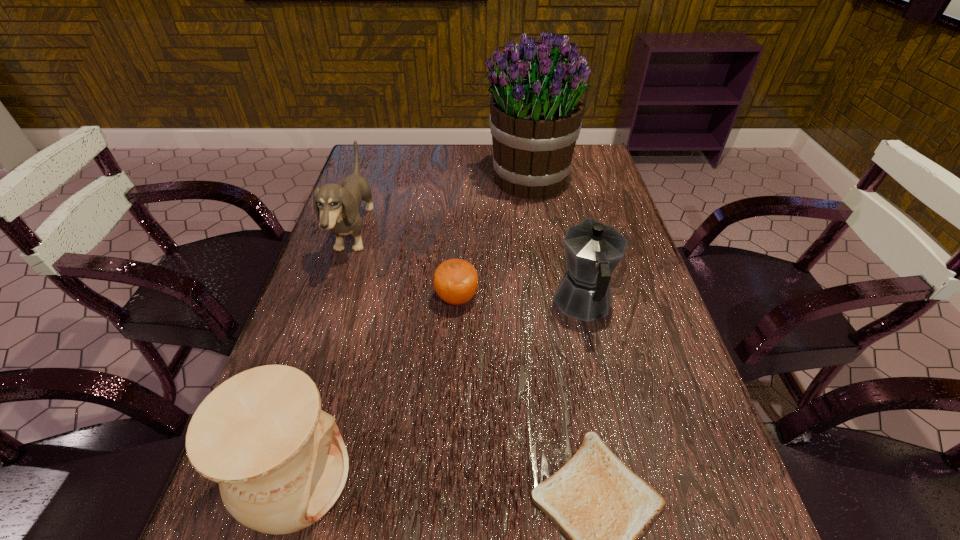
Locate an element on the screen. the tallest object is located at coordinates (536, 109).

Locate an element on the screen. The height and width of the screenshot is (540, 960). coffeepot is located at coordinates (593, 250).

The width and height of the screenshot is (960, 540). Identify the location of puppy. click(337, 207).

Where is `the third object from left to right`? This screenshot has width=960, height=540. the third object from left to right is located at coordinates (455, 281).

Image resolution: width=960 pixels, height=540 pixels. What are the coordinates of `orange` in the screenshot? It's located at (455, 281).

Image resolution: width=960 pixels, height=540 pixels. I want to click on vacant space located on the front of the bouquet, so click(540, 258).

The image size is (960, 540). I want to click on vacant space located 0.270m at the spout of the coffeepot, so click(562, 207).

Where is `free location located 0.340m at the spout of the coffeepot`? This screenshot has width=960, height=540. free location located 0.340m at the spout of the coffeepot is located at coordinates (559, 193).

Identify the location of free spot located 0.160m at the spout of the coffeepot. (567, 232).

Where is `vacant space located at the face of the puppy`? vacant space located at the face of the puppy is located at coordinates (498, 233).